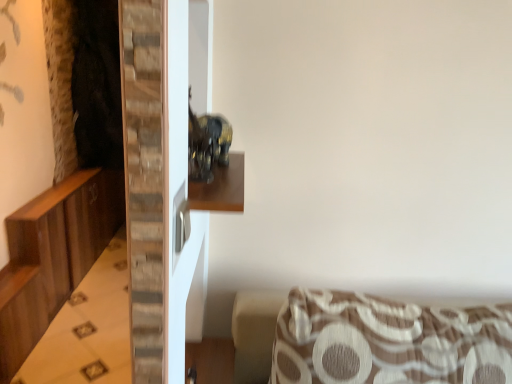
The height and width of the screenshot is (384, 512). In order to click on free spot below wooden shelf at center (from a real-world perspective) in this screenshot , I will do (x=211, y=363).